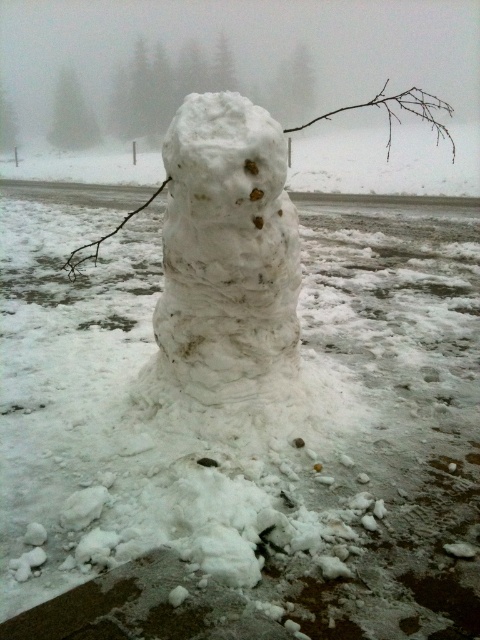
Question: Which is farther from the white snow at center?

Choices:
 (A) brown twig at center
 (B) white fluffy snowman at center

Answer: (B)

Question: Estimate the real-world distances between objects in this image. Which object is farther from the white snow at center?

Choices:
 (A) white fluffy snowman at center
 (B) brown twig at center

Answer: (A)

Question: Is white fluffy snowman at center smaller than white snow at center?

Choices:
 (A) no
 (B) yes

Answer: (B)

Question: Is white snow at center above brown twig at center?

Choices:
 (A) yes
 (B) no

Answer: (A)

Question: Which point is closer to the camera?

Choices:
 (A) (197, 122)
 (B) (163, 186)
 (C) (405, 90)

Answer: (A)

Question: Is white snow at center bigger than brown twig at center?

Choices:
 (A) yes
 (B) no

Answer: (A)